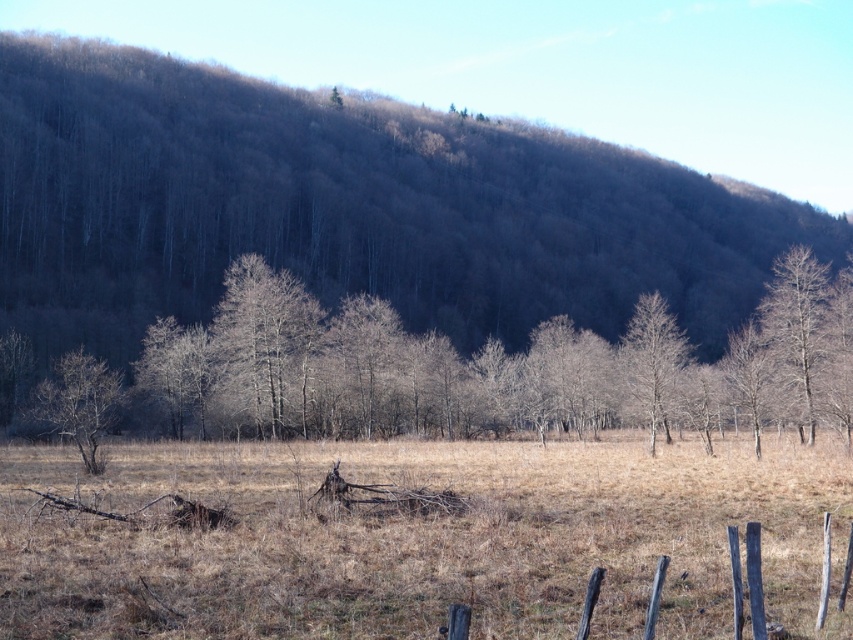
What do you see at coordinates (347, 209) in the screenshot? I see `brown/dry grass at upper center` at bounding box center [347, 209].

Is brown/dry grass at upper center to the left of bare wood tree at right from the viewer's perspective?

Correct, you'll find brown/dry grass at upper center to the left of bare wood tree at right.

The image size is (853, 640). What do you see at coordinates (347, 209) in the screenshot?
I see `brown/dry grass at upper center` at bounding box center [347, 209].

This screenshot has height=640, width=853. In order to click on brown/dry grass at upper center in this screenshot , I will do `click(347, 209)`.

Between weathered wood fence at lower right and bare wood tree at center, which one appears on the left side from the viewer's perspective?

From the viewer's perspective, weathered wood fence at lower right appears more on the left side.

Does weathered wood fence at lower right have a greater height compared to bare wood tree at center?

No.

Which is in front, point (738, 576) or point (666, 355)?

Point (738, 576) is more forward.

Image resolution: width=853 pixels, height=640 pixels. Find the location of `weathered wood fence at lower right`. weathered wood fence at lower right is located at coordinates (756, 582).

Image resolution: width=853 pixels, height=640 pixels. What do you see at coordinates (421, 538) in the screenshot?
I see `brown dry grass at center` at bounding box center [421, 538].

Can you confirm if brown dry grass at center is shorter than bare wood tree at right?

Correct, brown dry grass at center is not as tall as bare wood tree at right.

Locate an element on the screen. This screenshot has width=853, height=640. brown dry grass at center is located at coordinates (421, 538).